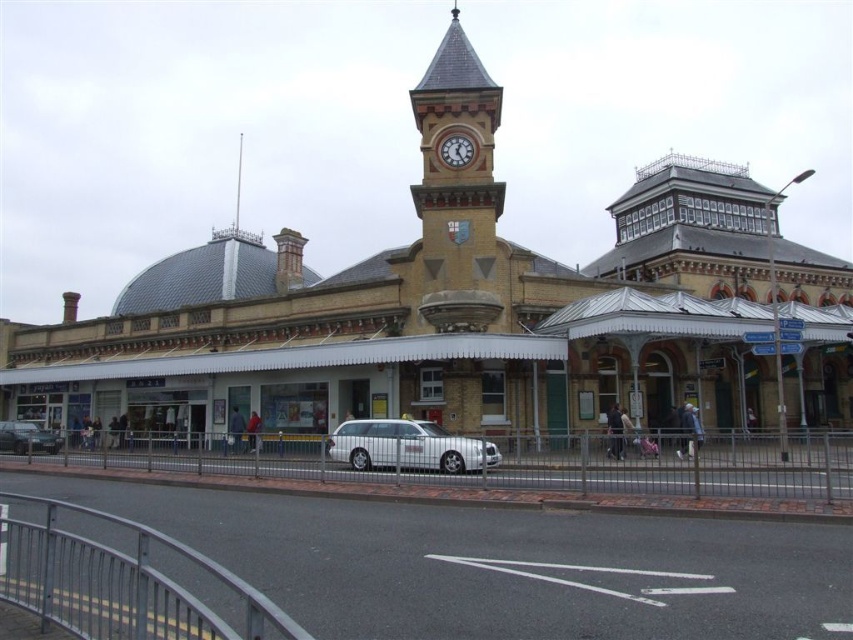
Question: Does silver metallic station wagon at center lie in front of metallic silver car at lower left?

Choices:
 (A) yes
 (B) no

Answer: (A)

Question: Which of the following is the closest to the observer?

Choices:
 (A) white painted metal clock at upper center
 (B) silver metallic station wagon at center

Answer: (B)

Question: Based on their relative distances, which object is farther from the metallic silver car at lower left?

Choices:
 (A) white painted metal clock at upper center
 (B) silver metallic station wagon at center

Answer: (A)

Question: Does metallic silver car at lower left appear on the right side of white painted metal clock at upper center?

Choices:
 (A) no
 (B) yes

Answer: (A)

Question: Which object is the closest to the metallic silver car at lower left?

Choices:
 (A) silver metallic station wagon at center
 (B) white painted metal clock at upper center

Answer: (A)

Question: Is silver metallic station wagon at center bigger than white painted metal clock at upper center?

Choices:
 (A) yes
 (B) no

Answer: (A)